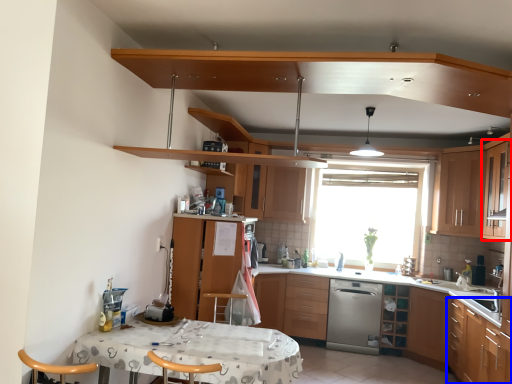
Question: Among these objects, which one is farthest to the camera, cabinetry (highlighted by a red box) or cabinetry (highlighted by a blue box)?

Choices:
 (A) cabinetry
 (B) cabinetry

Answer: (A)